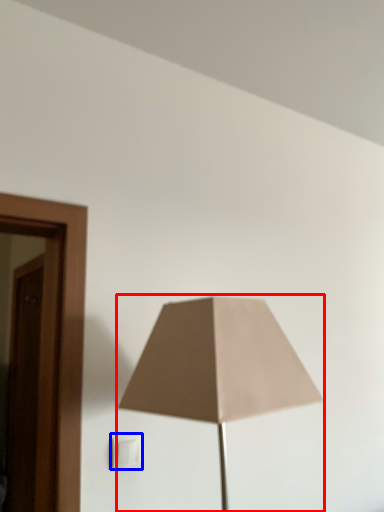
Question: Which of the following is the closest to the observer, lamp (highlighted by a red box) or electric outlet (highlighted by a blue box)?

Choices:
 (A) lamp
 (B) electric outlet

Answer: (A)